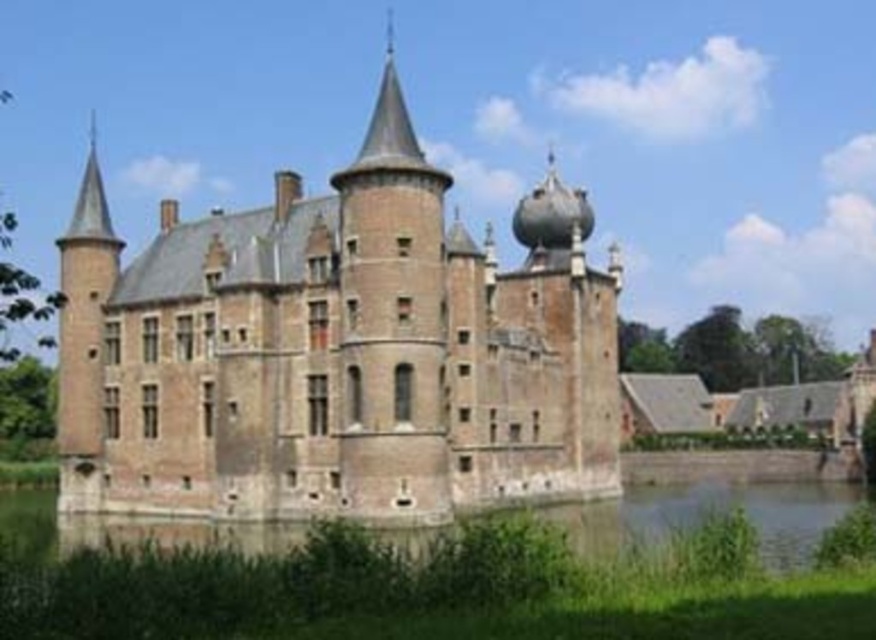
You are a knight standing at the coordinates 0.5, 0.4 in the scene. You need to reach the brown brick castle at center. Which direction should you move to get closer to the castle?

The brown brick castle at center is located at point [337,349]. Since you are at [350,320], you should move slightly to the right and down to reach the castle.

You are an architect planning to add a new structure between the brown brick castle at center and the brown stone wall at lower center. Given their widths, which object should the new structure be placed closer to in order to maintain balance?

The new structure should be placed closer to the brown brick castle at center since it has a lesser width compared to the brown stone wall at lower center, helping to balance the overall composition.

You are a knight standing on the brown stone wall at lower center and want to reach the brown brick castle at center. Which direction should you move to get closer to the castle?

You should move forward towards the brown brick castle at center because it is closer to you than the brown stone wall at lower center, which you are currently standing on.